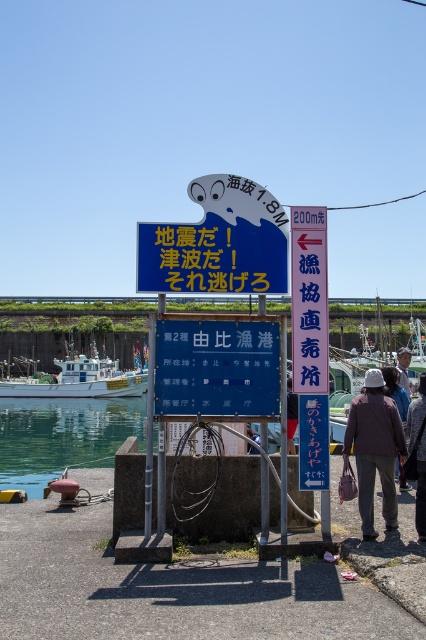
Question: Observing the image, what is the correct spatial positioning of brown fabric jacket at center in reference to white hat at center?

Choices:
 (A) left
 (B) right

Answer: (A)

Question: Which point is closer to the camera?

Choices:
 (A) brown fabric jacket at center
 (B) blue plastic signboard at center
 (C) blue plastic sign at center
 (D) brown matte jacket at center

Answer: (C)

Question: Which object is the farthest from the brown fabric jacket at center?

Choices:
 (A) clear water at lower left
 (B) brown matte jacket at center
 (C) white glossy boat at left

Answer: (C)

Question: Is blue plastic sign at center to the right of brown fabric jacket at center from the viewer's perspective?

Choices:
 (A) no
 (B) yes

Answer: (A)

Question: Estimate the real-world distances between objects in this image. Which object is closer to the brown fabric jacket at center?

Choices:
 (A) matte brown jacket at center
 (B) blue plastic sign at center

Answer: (A)

Question: Does blue plastic signboard at center have a larger size compared to brown matte jacket at center?

Choices:
 (A) yes
 (B) no

Answer: (B)